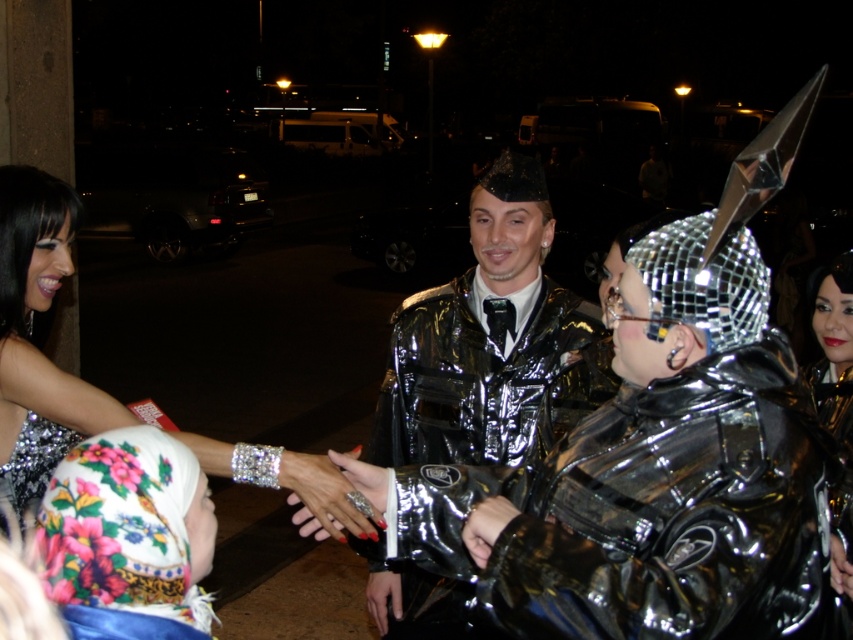
You are at a party and want to take a photo with both the shiny metallic jacket at center and the silver sequined dress at left. Since you want them to appear equally tall in the photo, which one should you move closer to the camera?

You should move the silver sequined dress at left closer to the camera because the shiny metallic jacket at center is taller in reality. By positioning the shorter object closer, their apparent sizes in the photo will balance out.

From the picture: You are standing at the origin point of the coordinate system in the image. The image has a coordinate system where the bottom left corner is the origin. You want to locate the shiny metallic jacket at center. Which direction should you move to reach it?

The shiny metallic jacket at center is located at coordinate point 0.536 on the x axis and 0.578 on the y axis. Since the origin is at the bottom left corner, moving right along the x axis and up along the y axis will reach the jacket.